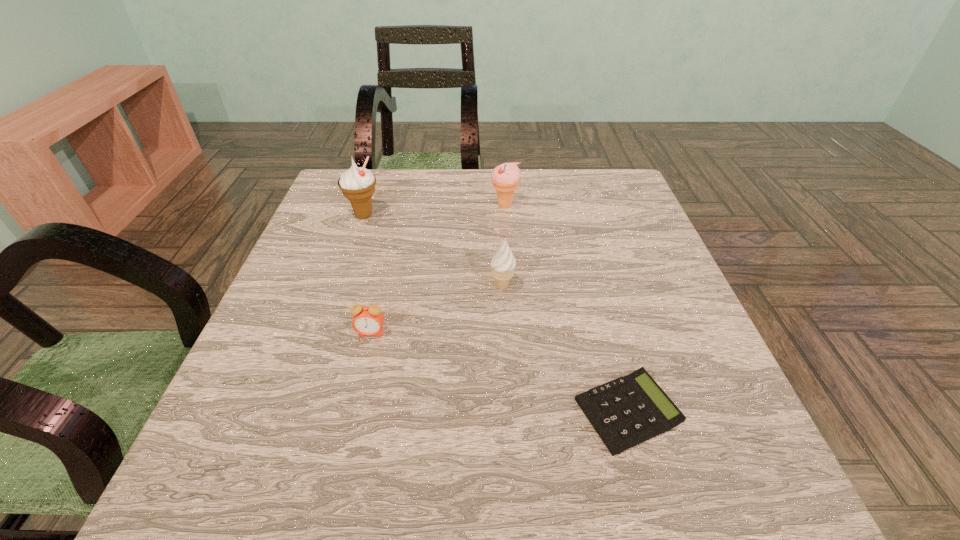
Identify the location of vacant position at the left edge of the desktop. (354, 223).

At what (x,y) coordinates should I click in order to perform the action: click on free space at the right edge of the desktop. Please return your answer as a coordinate pair (x, y). The width and height of the screenshot is (960, 540). Looking at the image, I should click on (671, 310).

At what (x,y) coordinates should I click in order to perform the action: click on vacant space at the far left corner of the desktop. Please return your answer as a coordinate pair (x, y). Looking at the image, I should click on (337, 187).

Image resolution: width=960 pixels, height=540 pixels. In the image, there is a desktop. In order to click on vacant space at the near left corner in this screenshot , I will do `click(261, 508)`.

I want to click on free space that is in between the second shortest object and the tallest object, so click(368, 274).

Where is `vacant area between the third farthest object and the calculator`? The image size is (960, 540). vacant area between the third farthest object and the calculator is located at coordinates (564, 349).

This screenshot has width=960, height=540. I want to click on empty location between the nearest icecream and the leftmost object, so click(433, 251).

This screenshot has width=960, height=540. I want to click on vacant area that lies between the rightmost object and the tallest icecream, so click(x=495, y=313).

This screenshot has height=540, width=960. What are the coordinates of `blank region between the alarm clock and the tallest icecream` in the screenshot? It's located at [368, 274].

The width and height of the screenshot is (960, 540). I want to click on free space between the second shortest object and the nearest icecream, so click(437, 310).